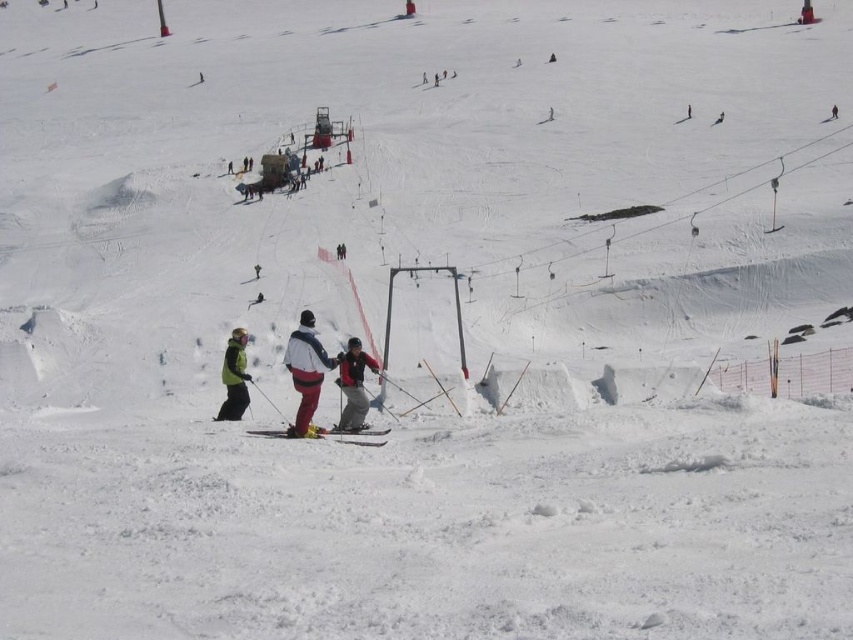
Who is positioned more to the right, white matte jacket at center or red ski jacket at center?

From the viewer's perspective, red ski jacket at center appears more on the right side.

Who is more distant from viewer, (312, 390) or (347, 344)?

The point (347, 344) is more distant.

Where is `white matte jacket at center`? white matte jacket at center is located at coordinates (306, 371).

The width and height of the screenshot is (853, 640). Identify the location of white matte jacket at center. (306, 371).

Who is higher up, white matte jacket at center or green matte jacket at lower left?

white matte jacket at center

Which of these two, white matte jacket at center or green matte jacket at lower left, stands taller?

white matte jacket at center is taller.

Which is behind, point (306, 417) or point (223, 410)?

Point (223, 410)

Locate an element on the screen. This screenshot has height=640, width=853. white matte jacket at center is located at coordinates (306, 371).

In the scene shown: Does green matte jacket at lower left appear on the right side of yellow matte ski at center?

In fact, green matte jacket at lower left is to the left of yellow matte ski at center.

Is green matte jacket at lower left further to camera compared to yellow matte ski at center?

That is True.

Is point (234, 355) positioned behind point (363, 433)?

Yes, it is.

I want to click on green matte jacket at lower left, so click(x=234, y=376).